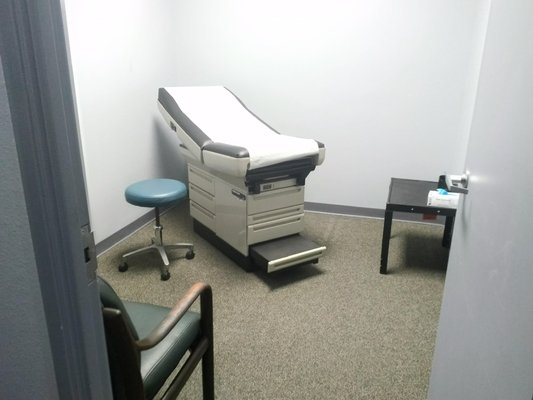
Identify the location of table used in the medical fiend for examinations. This screenshot has height=400, width=533. (228, 164).